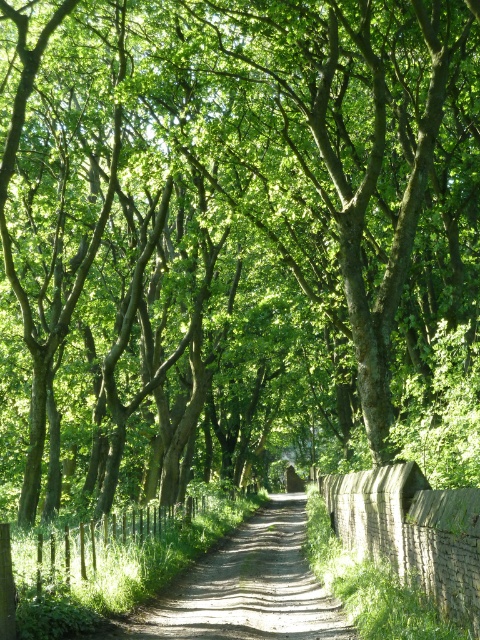
Which of these two, dirt/gravel path at center or brick wall at right, stands shorter?

Standing shorter between the two is brick wall at right.

Does point (144, 625) come in front of point (436, 502)?

No, (144, 625) is behind (436, 502).

Who is more distant from viewer, (229, 572) or (420, 499)?

The point (229, 572) is behind.

Identify the location of dirt/gravel path at center. This screenshot has width=480, height=640. (247, 588).